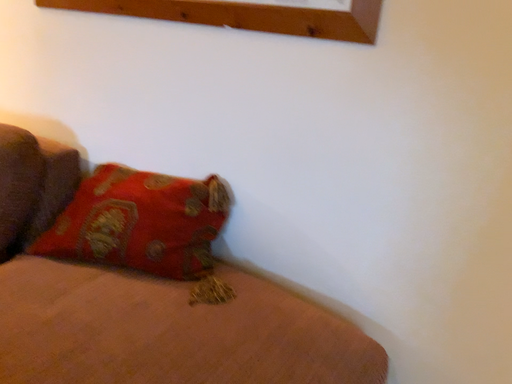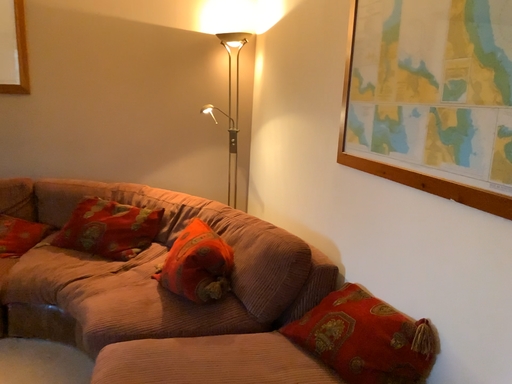
Question: Which way did the camera rotate in the video?

Choices:
 (A) rotated downward
 (B) rotated upward

Answer: (B)